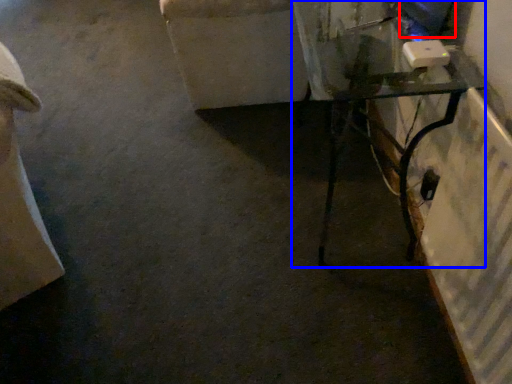
Question: Which object appears closest to the camera in this image, computer screen (highlighted by a red box) or table (highlighted by a blue box)?

Choices:
 (A) computer screen
 (B) table

Answer: (B)